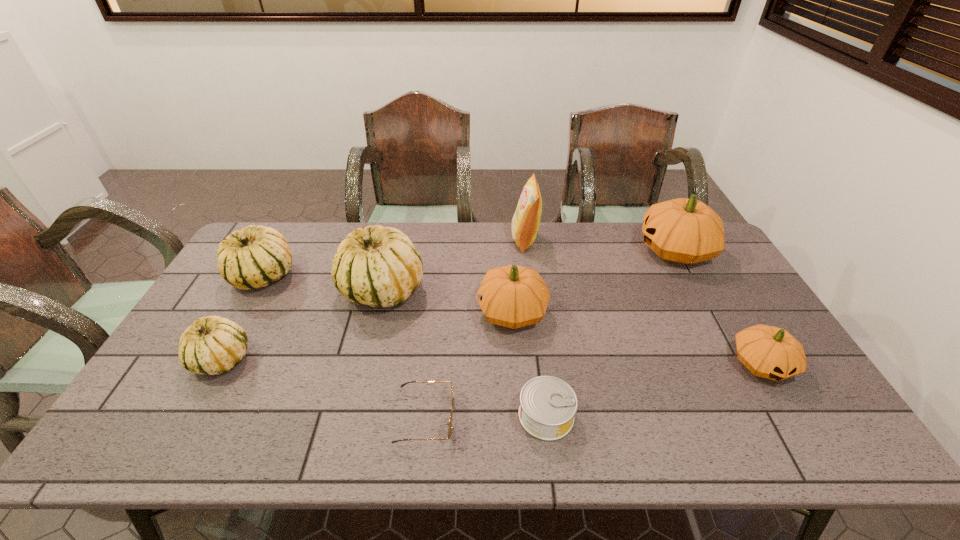
Where is `free space located 0.280m on the side of the second biggest orange gourd with the carved face`? The width and height of the screenshot is (960, 540). free space located 0.280m on the side of the second biggest orange gourd with the carved face is located at coordinates (381, 312).

At what (x,y) coordinates should I click in order to perform the action: click on free space located 0.210m on the right of the second biggest white gourd. Please return your answer as a coordinate pair (x, y). This screenshot has width=960, height=540. Looking at the image, I should click on (362, 276).

You are a GUI agent. You are given a task and a screenshot of the screen. Output one action in this format:
    pyautogui.click(x=<x>, y=<y>)
    Task: Click on the vacant space positioned on the side of the smallest orange gourd with the carved face
    This screenshot has height=540, width=960.
    Given the screenshot: What is the action you would take?
    pyautogui.click(x=792, y=415)

Where is `vacant region located on the right of the nearest white gourd`? The image size is (960, 540). vacant region located on the right of the nearest white gourd is located at coordinates (324, 359).

Locate an element on the screen. Image resolution: width=960 pixels, height=540 pixels. vacant space located on the right of the silver can is located at coordinates (595, 415).

Locate an element on the screen. The width and height of the screenshot is (960, 540). vacant area situated on the lenses of the sunglasses is located at coordinates (526, 417).

Locate an element on the screen. The image size is (960, 540). crisp (potato chip) that is at the far edge is located at coordinates (525, 223).

Locate an element on the screen. can located in the near edge section of the desktop is located at coordinates (548, 404).

Find the location of a particular element. sunglasses that is at the near edge is located at coordinates (451, 413).

The height and width of the screenshot is (540, 960). I want to click on object that is positioned at the far left corner, so click(x=254, y=257).